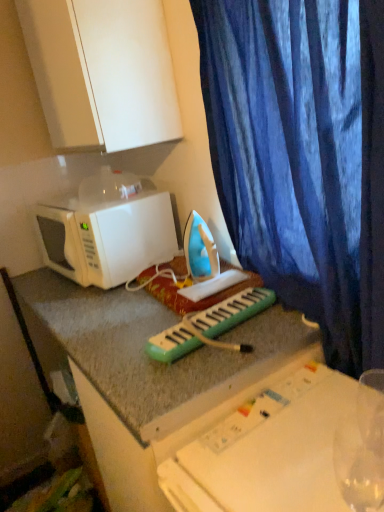
Question: Is green plastic musical keyboard at center facing away from white plastic table at center?

Choices:
 (A) no
 (B) yes

Answer: (A)

Question: From a real-world perspective, is green plastic musical keyboard at center below white plastic table at center?

Choices:
 (A) no
 (B) yes

Answer: (A)

Question: Is green plastic musical keyboard at center bigger than white plastic table at center?

Choices:
 (A) yes
 (B) no

Answer: (B)

Question: From a real-world perspective, is green plastic musical keyboard at center over white plastic table at center?

Choices:
 (A) no
 (B) yes

Answer: (B)

Question: From the image's perspective, does green plastic musical keyboard at center appear higher than white plastic table at center?

Choices:
 (A) no
 (B) yes

Answer: (B)

Question: From a real-world perspective, is green plastic musical keyboard at center above or below blue velvet curtain at right?

Choices:
 (A) above
 (B) below

Answer: (B)

Question: Visually, is green plastic musical keyboard at center positioned to the left or to the right of blue velvet curtain at right?

Choices:
 (A) right
 (B) left

Answer: (B)

Question: Looking at the image, does green plastic musical keyboard at center seem bigger or smaller compared to blue velvet curtain at right?

Choices:
 (A) big
 (B) small

Answer: (B)

Question: Considering their positions, is green plastic musical keyboard at center located in front of or behind blue velvet curtain at right?

Choices:
 (A) front
 (B) behind

Answer: (B)

Question: Relative to white plastic table at center, is blue velvet curtain at right in front or behind?

Choices:
 (A) front
 (B) behind

Answer: (B)

Question: From the image's perspective, is blue velvet curtain at right located above or below white plastic table at center?

Choices:
 (A) below
 (B) above

Answer: (B)

Question: From a real-world perspective, is blue velvet curtain at right positioned above or below white plastic table at center?

Choices:
 (A) below
 (B) above

Answer: (B)

Question: Choose the correct answer: Is blue velvet curtain at right inside white plastic table at center or outside it?

Choices:
 (A) inside
 (B) outside

Answer: (B)

Question: Is point (294, 260) positioned closer to the camera than point (182, 337)?

Choices:
 (A) closer
 (B) farther

Answer: (B)

Question: In terms of height, does blue velvet curtain at right look taller or shorter compared to green plastic musical keyboard at center?

Choices:
 (A) short
 (B) tall

Answer: (B)